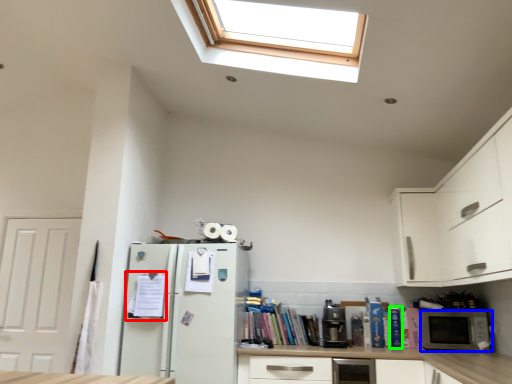
Question: Considering the real-world distances, which object is farthest from book (highlighted by a red box)? microwave oven (highlighted by a blue box) or book (highlighted by a green box)?

Choices:
 (A) microwave oven
 (B) book

Answer: (A)